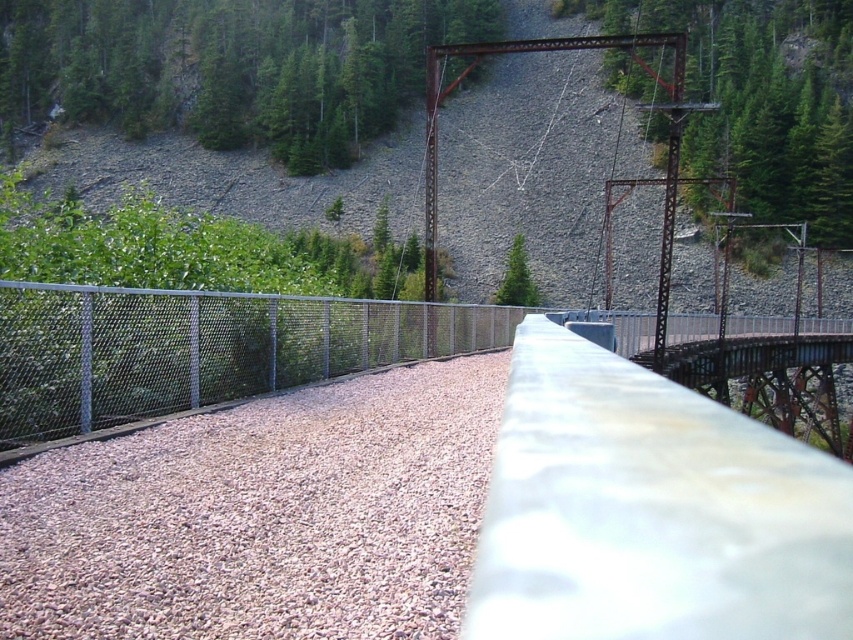
Between point (9, 310) and point (527, 304), which one is positioned in front?

Point (9, 310) is in front.

I want to click on silver chain-link fence at left, so click(x=200, y=348).

Which is behind, point (155, 305) or point (511, 291)?

Point (511, 291)

You are a GUI agent. You are given a task and a screenshot of the screen. Output one action in this format:
    pyautogui.click(x=<x>, y=<y>)
    Task: Click on the silver chain-link fence at left
    This screenshot has height=640, width=853.
    Given the screenshot: What is the action you would take?
    pyautogui.click(x=200, y=348)

Which of these two, green matte tree at upper center or silver chain-link fence at left, stands shorter?

Standing shorter between the two is silver chain-link fence at left.

Between point (315, 97) and point (418, 317), which one is positioned in front?

Point (418, 317) is more forward.

Who is more forward, (108, 88) or (68, 285)?

Point (68, 285)

Find the location of a particular element. This screenshot has height=640, width=853. green matte tree at upper center is located at coordinates (231, 67).

Does point (334, 90) come behind point (509, 292)?

Yes, point (334, 90) is farther from viewer.

Is green matte tree at upper center shorter than green matte tree at center?

Incorrect, green matte tree at upper center's height does not fall short of green matte tree at center's.

At what (x,y) coordinates should I click in order to perform the action: click on green matte tree at upper center. Please return your answer as a coordinate pair (x, y). Looking at the image, I should click on (231, 67).

Locate an element on the screen. This screenshot has width=853, height=640. green matte tree at upper center is located at coordinates (231, 67).